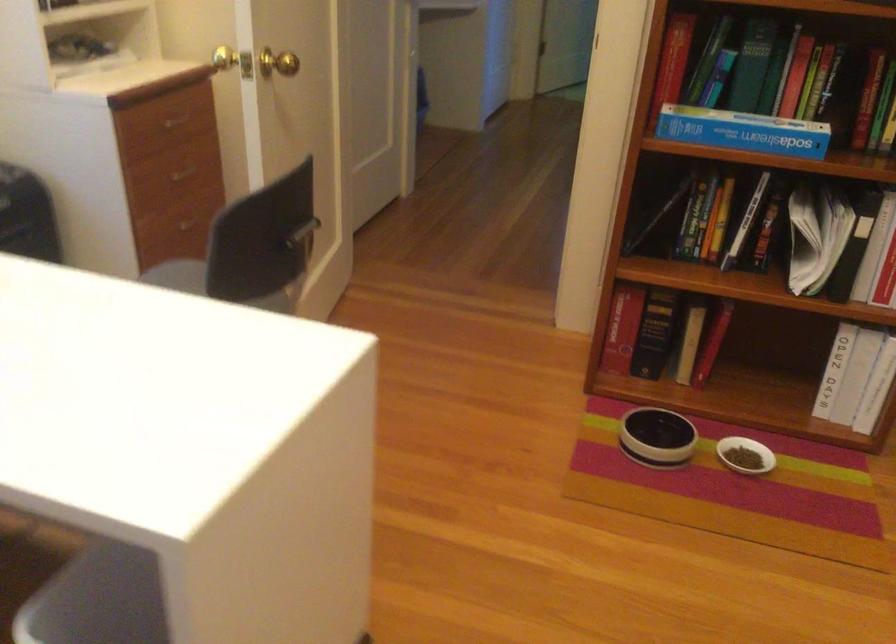
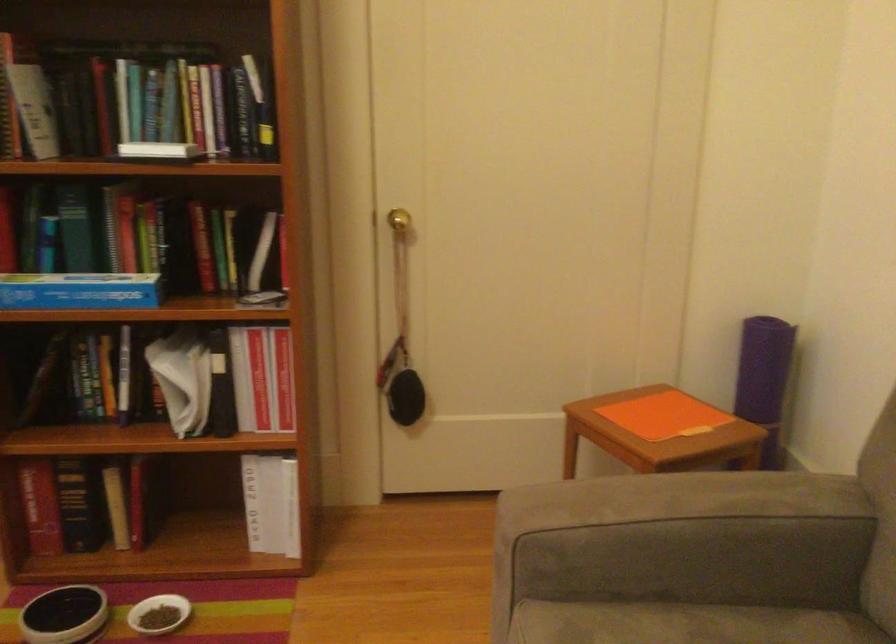
Question: The images are taken continuously from a first-person perspective. In which direction are you moving?

Choices:
 (A) Left
 (B) Right
 (C) Forward
 (D) Backward

Answer: (B)